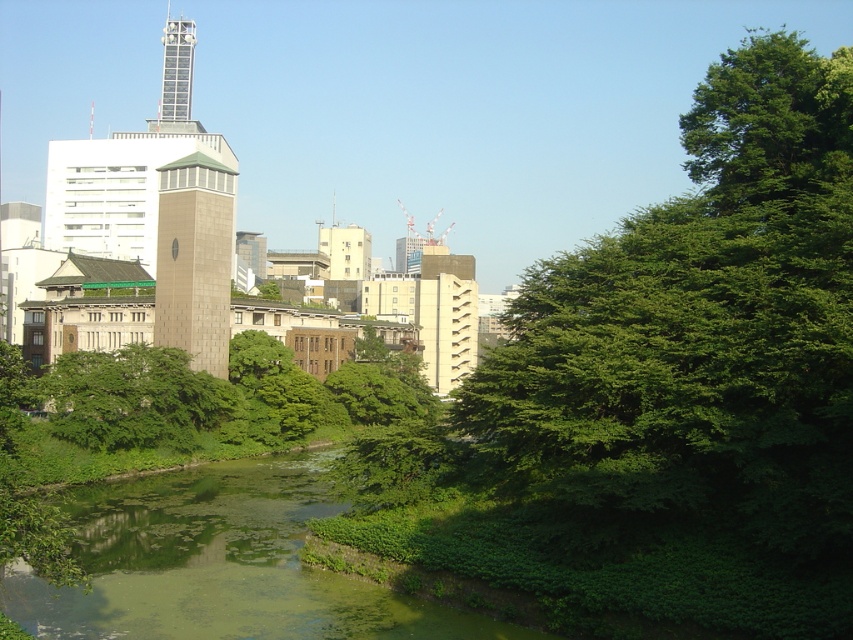
Based on the scene description, where is the green leafy tree at center located in the image?

The green leafy tree at center is located at point (135, 397).